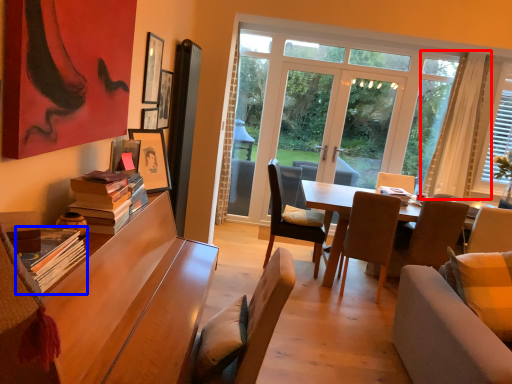
Question: Which object is further to the camera taking this photo, curtain (highlighted by a red box) or book (highlighted by a blue box)?

Choices:
 (A) curtain
 (B) book

Answer: (A)